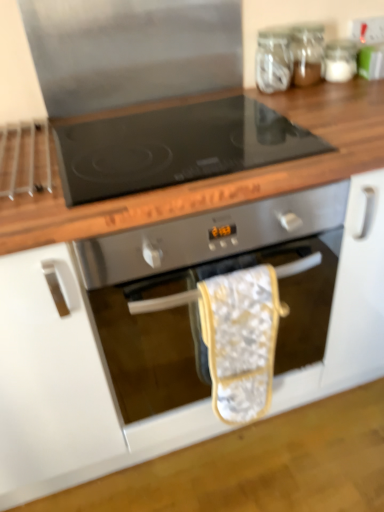
Image resolution: width=384 pixels, height=512 pixels. I want to click on vacant space in front of transparent glass jar at upper right, the first glass jar from the left, so point(291,104).